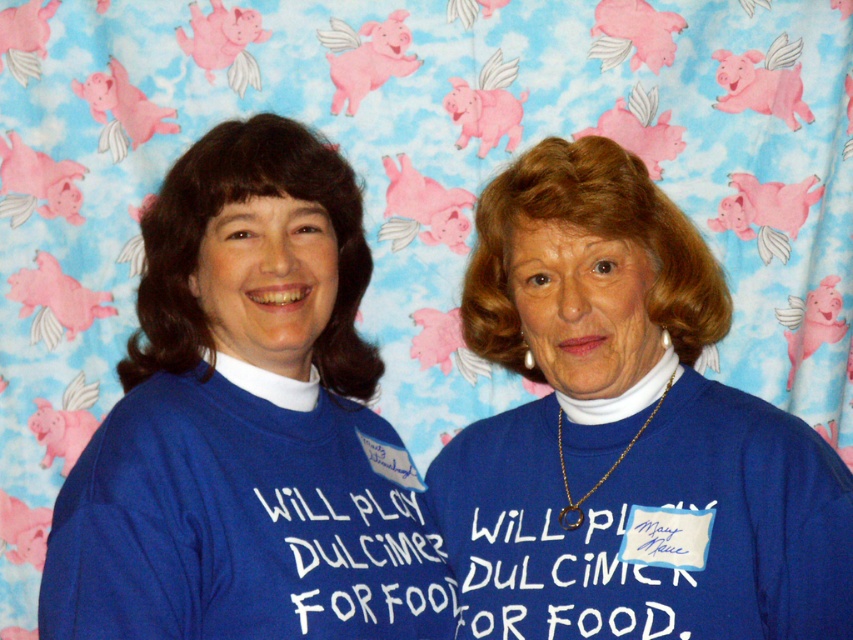
Consider the image. You are a costume designer preparing for a play and need to decide which blue shirt to use for the main character. The scene requires the character to wear a shirt that will be visible from the audience seats in the back row. Which shirt, the blue cotton shirt at center or the blue matte shirt at center, should you choose based on visibility?

The blue matte shirt at center is more visible from a distance because it has a smoother, nonreflective surface that allows for clearer visibility compared to the blue cotton shirt at center, which may have a softer texture that could blend in more with the background.

In the scene shown: You are a photographer setting up for a group photo. You need to position two subjects wearing blue cotton shirt at center and blue matte shirt at center so that their shirts are exactly 12 inches apart. Currently, their shirts are 10.06 inches apart. Should you move them closer or farther apart?

The current distance between the blue cotton shirt at center and blue matte shirt at center is 10.06 inches. Since 10.06 is less than 12 inches, you should move them farther apart to achieve the desired 12 inches distance.